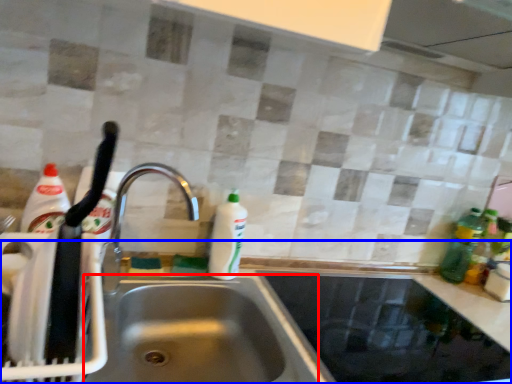
Question: Which object is further to the camera taking this photo, sink (highlighted by a red box) or counter top (highlighted by a blue box)?

Choices:
 (A) sink
 (B) counter top

Answer: (A)